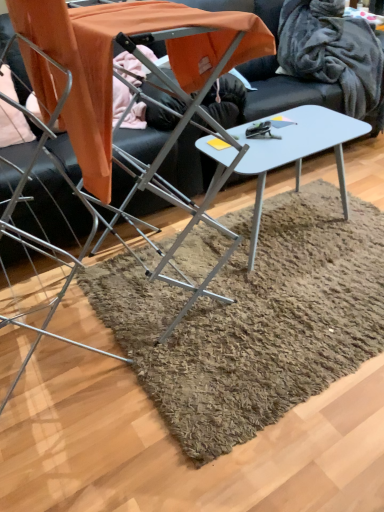
What is the approximate width of velvety gray blanket at upper right?

velvety gray blanket at upper right is 16.69 inches in width.

At what (x,y) coordinates should I click in order to perform the action: click on metallic gray table at center, the 1th table from the front. Please return your answer as a coordinate pair (x, y). The image size is (384, 512). Looking at the image, I should click on (112, 61).

Locate an element on the screen. This screenshot has height=512, width=384. metallic silver chair at left is located at coordinates pos(43,241).

Find the location of a particular element. velvety gray blanket at upper right is located at coordinates (333, 52).

Considering the sizes of objects velvety gray blanket at upper right and metallic silver chair at left in the image provided, who is bigger, velvety gray blanket at upper right or metallic silver chair at left?

velvety gray blanket at upper right.

From a real-world perspective, is velvety gray blanket at upper right positioned under metallic silver chair at left based on gravity?

Yes, from a real-world perspective, velvety gray blanket at upper right is beneath metallic silver chair at left.

How different are the orientations of velvety gray blanket at upper right and metallic silver chair at left in degrees?

They differ by 4.3 degrees in their facing directions.

Considering the relative positions of velvety gray blanket at upper right and metallic silver chair at left in the image provided, is velvety gray blanket at upper right to the right of metallic silver chair at left from the viewer's perspective?

Indeed, velvety gray blanket at upper right is positioned on the right side of metallic silver chair at left.

From a real-world perspective, is metallic silver chair at left on top of light gray plastic table at center, which is counted as the second table, starting from the front?

Yes, from a real-world perspective, metallic silver chair at left is over light gray plastic table at center, which is counted as the second table, starting from the front

Measure the distance from metallic silver chair at left to light gray plastic table at center, the 1th table when ordered from back to front.

metallic silver chair at left is 23.40 inches away from light gray plastic table at center, the 1th table when ordered from back to front.

Is point (26, 231) closer or farther from the camera than point (283, 117)?

Point (26, 231) is closer to the camera than point (283, 117).

Is metallic silver chair at left positioned far away from light gray plastic table at center, the 1th table when ordered from back to front?

No.

Considering the sizes of objects metallic silver chair at left and velvety gray blanket at upper right in the image provided, who is bigger, metallic silver chair at left or velvety gray blanket at upper right?

velvety gray blanket at upper right is bigger.

Considering the relative positions of metallic silver chair at left and velvety gray blanket at upper right in the image provided, is metallic silver chair at left to the left or to the right of velvety gray blanket at upper right?

In the image, metallic silver chair at left appears on the left side of velvety gray blanket at upper right.

Consider the image. Is metallic silver chair at left next to velvety gray blanket at upper right and touching it?

metallic silver chair at left and velvety gray blanket at upper right are clearly separated.

Find the location of a particular element. This screenshot has height=512, width=384. chair on the left of velvety gray blanket at upper right is located at coordinates click(43, 241).

Considering the relative sizes of velvety gray blanket at upper right and metallic gray table at center, arranged as the 2th table when viewed from the back, in the image provided, is velvety gray blanket at upper right thinner than metallic gray table at center, arranged as the 2th table when viewed from the back,?

Correct, the width of velvety gray blanket at upper right is less than that of metallic gray table at center, arranged as the 2th table when viewed from the back.

From the image's perspective, is velvety gray blanket at upper right beneath metallic gray table at center, arranged as the 2th table when viewed from the back?

No.

How different are the orientations of velvety gray blanket at upper right and metallic gray table at center, the 1th table from the front, in degrees?

6.01 degrees.

Is velvety gray blanket at upper right situated inside metallic gray table at center, arranged as the 2th table when viewed from the back, or outside?

velvety gray blanket at upper right exists outside the volume of metallic gray table at center, arranged as the 2th table when viewed from the back.

In order to click on the 2nd table counting from the left of the velvety gray blanket at upper right in this screenshot , I will do `click(112, 61)`.

Visually, is metallic gray table at center, the 1th table from the front, positioned to the left or to the right of velvety gray blanket at upper right?

Clearly, metallic gray table at center, the 1th table from the front, is on the left of velvety gray blanket at upper right in the image.

From a real-world perspective, is metallic gray table at center, arranged as the 2th table when viewed from the back, under velvety gray blanket at upper right?

Actually, metallic gray table at center, arranged as the 2th table when viewed from the back, is physically above velvety gray blanket at upper right in the real world.

Could you measure the distance between metallic gray table at center, arranged as the 2th table when viewed from the back, and velvety gray blanket at upper right?

They are 4.87 feet apart.

Which is behind, light gray plastic table at center, the 1th table when ordered from back to front, or velvety gray blanket at upper right?

velvety gray blanket at upper right.

Does light gray plastic table at center, which is counted as the second table, starting from the front, contain velvety gray blanket at upper right?

No, velvety gray blanket at upper right is not surrounded by light gray plastic table at center, which is counted as the second table, starting from the front.

From the picture: Could you tell me if light gray plastic table at center, the 1th table when ordered from back to front, is turned towards velvety gray blanket at upper right?

No, light gray plastic table at center, the 1th table when ordered from back to front, is not oriented towards velvety gray blanket at upper right.

Considering the sizes of objects light gray plastic table at center, which is counted as the second table, starting from the front, and velvety gray blanket at upper right in the image provided, who is bigger, light gray plastic table at center, which is counted as the second table, starting from the front, or velvety gray blanket at upper right?

With larger size is light gray plastic table at center, which is counted as the second table, starting from the front.

Does point (287, 69) lie in front of point (252, 157)?

That is False.

Considering the relative sizes of velvety gray blanket at upper right and light gray plastic table at center, which is counted as the second table, starting from the front, in the image provided, is velvety gray blanket at upper right shorter than light gray plastic table at center, which is counted as the second table, starting from the front,?

No.

From the image's perspective, which is below, velvety gray blanket at upper right or light gray plastic table at center, the 1th table when ordered from back to front?

light gray plastic table at center, the 1th table when ordered from back to front, from the image's perspective.

Is velvety gray blanket at upper right positioned with its back to light gray plastic table at center, the 1th table when ordered from back to front?

No, velvety gray blanket at upper right is not facing away from light gray plastic table at center, the 1th table when ordered from back to front.

The width and height of the screenshot is (384, 512). In order to click on chair that appears on the left of velvety gray blanket at upper right in this screenshot , I will do `click(43, 241)`.

At what (x,y) coordinates should I click in order to perform the action: click on chair above the light gray plastic table at center, the 1th table when ordered from back to front (from the image's perspective). Please return your answer as a coordinate pair (x, y). The height and width of the screenshot is (512, 384). Looking at the image, I should click on (43, 241).

Looking at the image, which one is located closer to light gray plastic table at center, the 1th table when ordered from back to front, velvety gray blanket at upper right or metallic silver chair at left?

Among the two, metallic silver chair at left is located nearer to light gray plastic table at center, the 1th table when ordered from back to front.

When comparing their distances from velvety gray blanket at upper right, does light gray plastic table at center, which is counted as the second table, starting from the front, or metallic silver chair at left seem further?

metallic silver chair at left is positioned further to the anchor velvety gray blanket at upper right.

Based on their spatial positions, is metallic silver chair at left or velvety gray blanket at upper right further from metallic gray table at center, the 1th table from the front?

velvety gray blanket at upper right is further to metallic gray table at center, the 1th table from the front.

From the image, which object appears to be nearer to light gray plastic table at center, the 1th table when ordered from back to front, metallic gray table at center, arranged as the 2th table when viewed from the back, or metallic silver chair at left?

Based on the image, metallic gray table at center, arranged as the 2th table when viewed from the back, appears to be nearer to light gray plastic table at center, the 1th table when ordered from back to front.

Considering their positions, is light gray plastic table at center, which is counted as the second table, starting from the front, positioned closer to velvety gray blanket at upper right than metallic gray table at center, arranged as the 2th table when viewed from the back?

Among the two, light gray plastic table at center, which is counted as the second table, starting from the front, is located nearer to velvety gray blanket at upper right.

Considering their positions, is light gray plastic table at center, the 1th table when ordered from back to front, positioned further to metallic silver chair at left than velvety gray blanket at upper right?

velvety gray blanket at upper right is further to metallic silver chair at left.

From the image, which object appears to be farther from velvety gray blanket at upper right, metallic silver chair at left or metallic gray table at center, arranged as the 2th table when viewed from the back?

metallic silver chair at left.

Estimate the real-world distances between objects in this image. Which object is further from velvety gray blanket at upper right, metallic silver chair at left or light gray plastic table at center, which is counted as the second table, starting from the front?

metallic silver chair at left is positioned further to the anchor velvety gray blanket at upper right.

Where is `table between metallic silver chair at left and light gray plastic table at center, which is counted as the second table, starting from the front`? table between metallic silver chair at left and light gray plastic table at center, which is counted as the second table, starting from the front is located at coordinates (112, 61).

I want to click on table between metallic gray table at center, arranged as the 2th table when viewed from the back, and velvety gray blanket at upper right from front to back, so click(x=281, y=152).